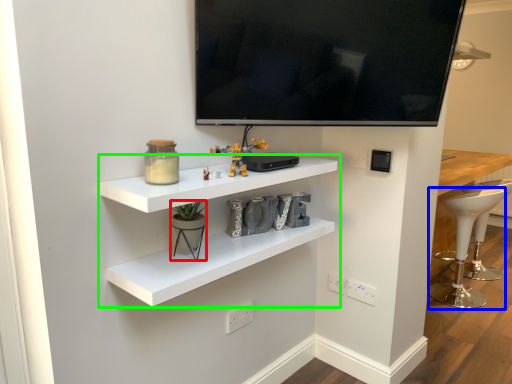
Question: Which object is the farthest from toy (highlighted by a red box)? Choose among these: bar stool (highlighted by a blue box) or shelf (highlighted by a green box).

Choices:
 (A) bar stool
 (B) shelf

Answer: (A)